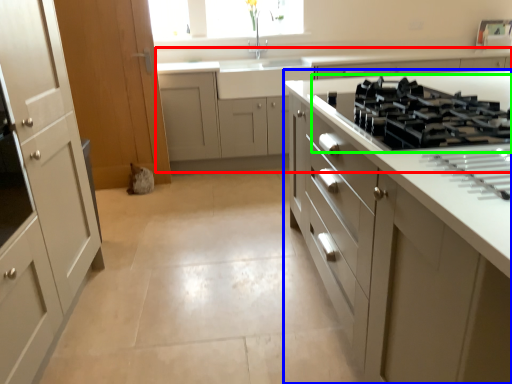
Question: Considering the real-world distances, which object is farthest from cabinetry (highlighted by a red box)? cabinetry (highlighted by a blue box) or gas stove (highlighted by a green box)?

Choices:
 (A) cabinetry
 (B) gas stove

Answer: (B)